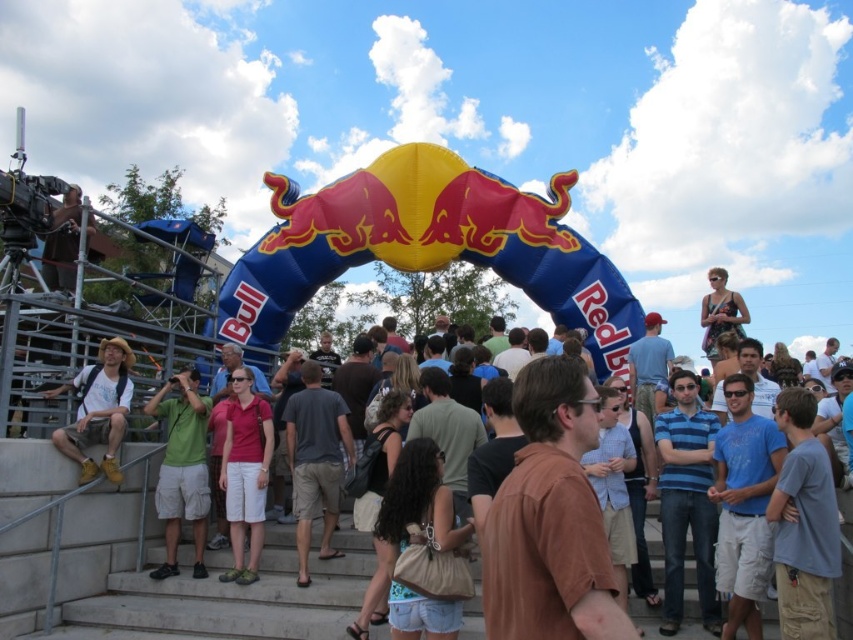
Question: Which object appears farthest from the camera in this image?

Choices:
 (A) matte gray shirt at center
 (B) green shirt at center

Answer: (B)

Question: Which of these objects is positioned closest to the blue cotton shirt at center?

Choices:
 (A) matte brown shirt at center
 (B) blue striped shirt at center
 (C) matte gray shirt at center
 (D) light brown leather jacket at center

Answer: (B)

Question: Can you confirm if matte pink shirt at center is smaller than dark gray hoodie at center?

Choices:
 (A) no
 (B) yes

Answer: (A)

Question: Which point is farther to the camera?

Choices:
 (A) green cotton shirt at lower left
 (B) light brown leather jacket at center

Answer: (B)

Question: Does matte pink shirt at center appear on the right side of dark gray hoodie at center?

Choices:
 (A) no
 (B) yes

Answer: (A)

Question: Observing the image, what is the correct spatial positioning of blue striped shirt at center in reference to dark gray cotton t-shirt at center?

Choices:
 (A) below
 (B) above

Answer: (A)